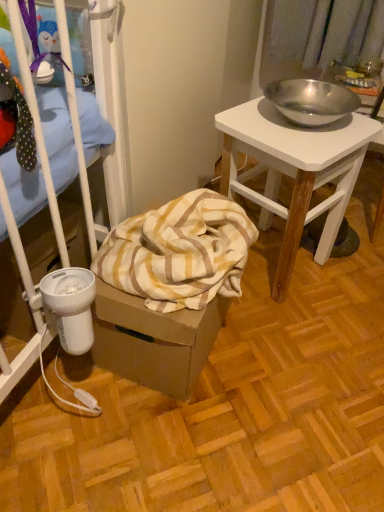
You are a GUI agent. You are given a task and a screenshot of the screen. Output one action in this format:
    pyautogui.click(x=<x>, y=<y>)
    Task: Click on the vacant space in front of polished metal bowl at upper right
    
    Given the screenshot: What is the action you would take?
    pyautogui.click(x=298, y=339)